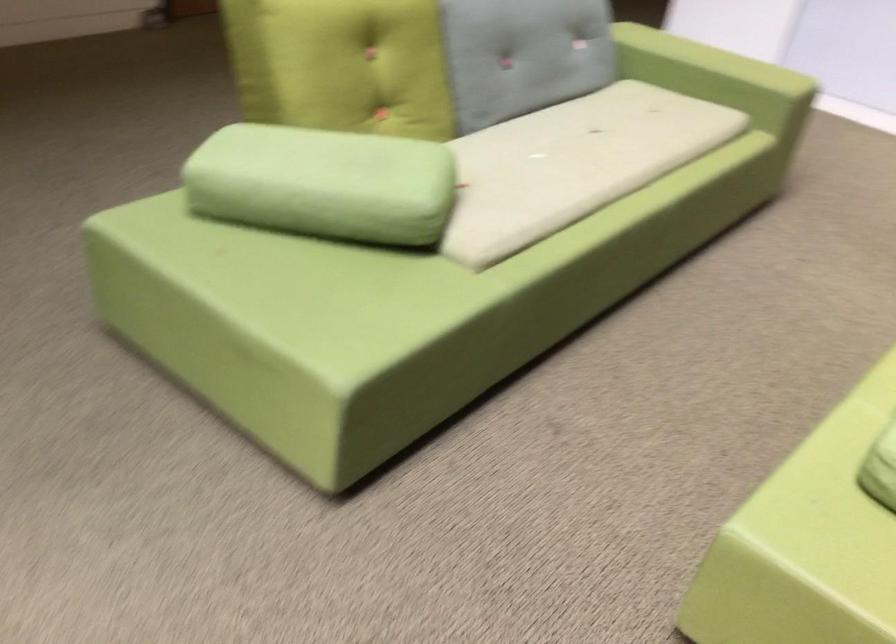
You are a GUI agent. You are given a task and a screenshot of the screen. Output one action in this format:
    pyautogui.click(x=<x>, y=<y>)
    Task: Click on the sofa armrest
    
    Given the screenshot: What is the action you would take?
    tap(717, 77)